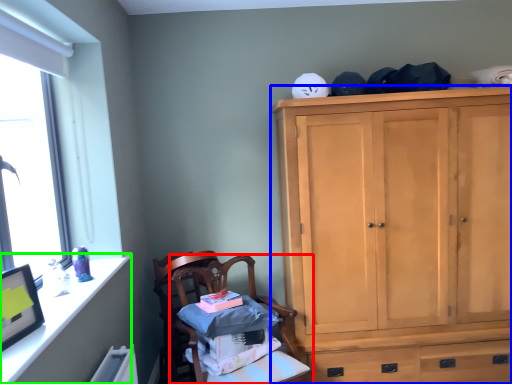
Question: Based on their relative distances, which object is nearer to chair (highlighted by a red box)? Choose from cabinetry (highlighted by a blue box) and vanity (highlighted by a green box).

Choices:
 (A) cabinetry
 (B) vanity

Answer: (B)